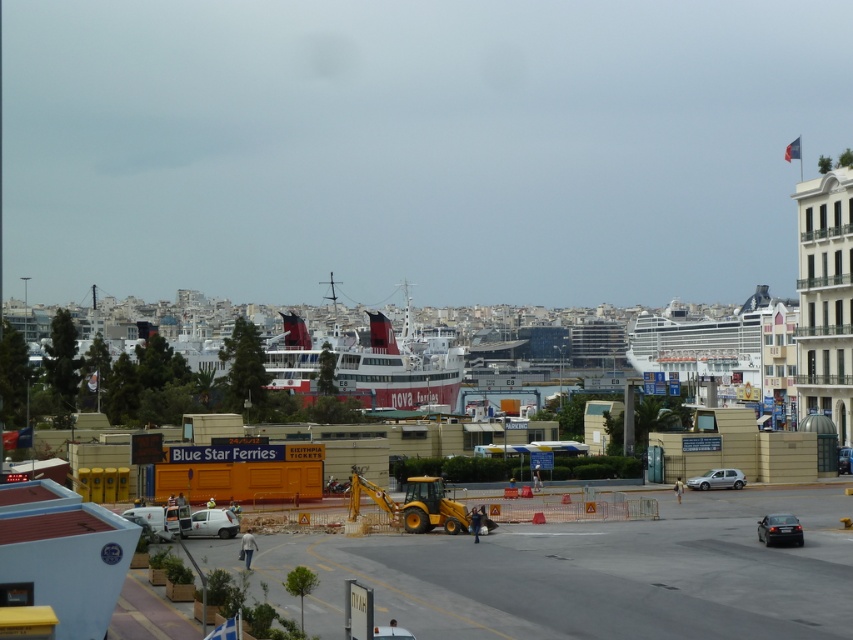
Question: Which is farther from the silver metallic car at center?

Choices:
 (A) black glossy car at lower right
 (B) white matte van at center
 (C) metallic blue car at center
 (D) white glossy cruise ship at center

Answer: (D)

Question: Which point is closer to the camera?

Choices:
 (A) (662, 368)
 (B) (787, 520)

Answer: (B)

Question: In this image, where is white matte van at center located relative to metallic blue car at center?

Choices:
 (A) right
 (B) left

Answer: (B)

Question: Can you confirm if white glossy cruise ship at center is wider than silver metallic car at center?

Choices:
 (A) no
 (B) yes

Answer: (B)

Question: From the image, what is the correct spatial relationship of white glossy cruise ship at center in relation to black glossy car at lower right?

Choices:
 (A) right
 (B) left

Answer: (A)

Question: Which point is closer to the camera?

Choices:
 (A) (772, 515)
 (B) (840, 458)

Answer: (A)